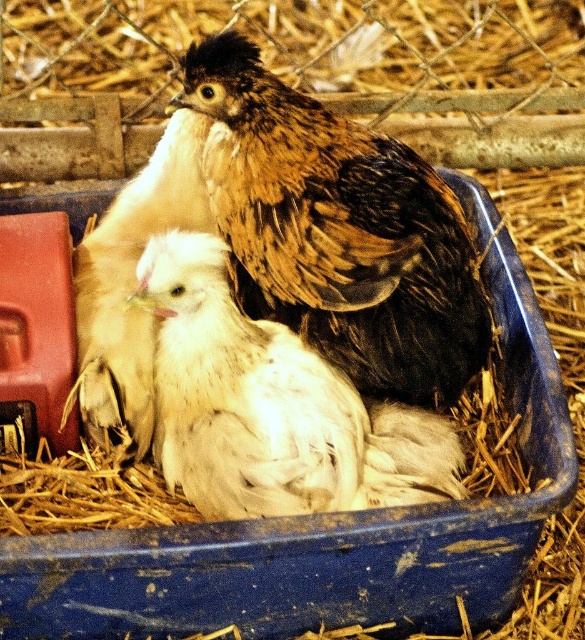
You are a farmer checking on your chickens. You notice both the brown feathered chicken at center and the white fluffy chick at center are in the same container. Which one is bigger?

The brown feathered chicken at center is larger in size compared to the white fluffy chick at center.

You are a farmer checking the location of your chickens in the container. The container has a coordinate system where the bottom left corner is the origin point. Can you determine the exact coordinates of the white fluffy chick at center?

The white fluffy chick at center is located at coordinates point (x=270, y=406).

Based on the photo, you are a farmer checking on your chickens. You notice two points marked in the container where the chickens are resting. The points are labeled as point (191,241) and point (91,372). Which point is closer to you when you are standing in front of the container?

Answer: Point (191,241) is in front of point (91,372), so it is closer to you when standing in front of the container.